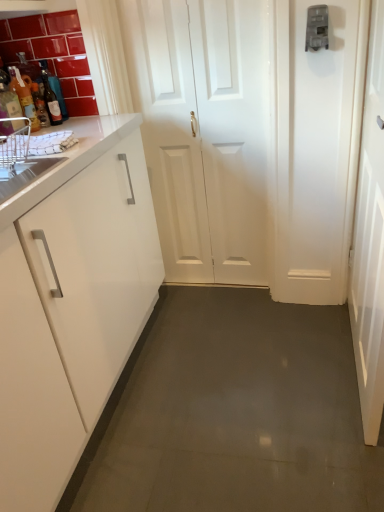
In order to click on white glossy door at center, which is the 1th door in left-to-right order in this screenshot , I will do `click(206, 132)`.

Looking at this image, what is the approximate height of white glossy sink at left?

white glossy sink at left is 6.37 inches in height.

I want to click on white glossy door at right, the second door from the left, so click(370, 240).

What is the approximate height of matte glass bottle at left, the 1th bottle viewed from the right?

matte glass bottle at left, the 1th bottle viewed from the right, is 7.41 inches tall.

The height and width of the screenshot is (512, 384). Describe the element at coordinates (40, 93) in the screenshot. I see `translucent glass bottle at left, arranged as the first bottle when viewed from the left` at that location.

Locate an element on the screen. white glossy door at center, which is the 1th door in left-to-right order is located at coordinates (206, 132).

How different are the orientations of matte glass bottle at left, which ranks as the third bottle in left-to-right order, and translucent glass bottle at left, arranged as the first bottle when viewed from the left, in degrees?

The facing directions of matte glass bottle at left, which ranks as the third bottle in left-to-right order, and translucent glass bottle at left, arranged as the first bottle when viewed from the left, are 0.00362 degrees apart.

In the scene shown: Is matte glass bottle at left, which ranks as the third bottle in left-to-right order, not within translucent glass bottle at left, arranged as the first bottle when viewed from the left?

Indeed, matte glass bottle at left, which ranks as the third bottle in left-to-right order, is completely outside translucent glass bottle at left, arranged as the first bottle when viewed from the left.

Can you confirm if matte glass bottle at left, the 1th bottle viewed from the right, is bigger than translucent glass bottle at left, the 3th bottle from the right?

Incorrect, matte glass bottle at left, the 1th bottle viewed from the right, is not larger than translucent glass bottle at left, the 3th bottle from the right.

Between matte glass bottle at left, the 1th bottle viewed from the right, and translucent glass bottle at left, arranged as the first bottle when viewed from the left, which one is positioned in front?

Positioned in front is matte glass bottle at left, the 1th bottle viewed from the right.

Considering the relative sizes of white glossy door at center, which is the 1th door in left-to-right order, and matte glass bottle at left, which ranks as the third bottle in left-to-right order, in the image provided, is white glossy door at center, which is the 1th door in left-to-right order, shorter than matte glass bottle at left, which ranks as the third bottle in left-to-right order,?

In fact, white glossy door at center, which is the 1th door in left-to-right order, may be taller than matte glass bottle at left, which ranks as the third bottle in left-to-right order.

Is white glossy door at center, acting as the 2th door starting from the right, behind matte glass bottle at left, which ranks as the third bottle in left-to-right order?

That is False.

Considering the relative sizes of white glossy door at center, which is the 1th door in left-to-right order, and matte glass bottle at left, which ranks as the third bottle in left-to-right order, in the image provided, is white glossy door at center, which is the 1th door in left-to-right order, wider than matte glass bottle at left, which ranks as the third bottle in left-to-right order,?

Yes.

Considering the points (230, 113) and (46, 85), which point is behind, point (230, 113) or point (46, 85)?

The point (230, 113) is behind.

Which object is positioned more to the left, translucent glass bottle at left, marked as the second bottle in a right-to-left arrangement, or translucent glass bottle at left, arranged as the first bottle when viewed from the left?

translucent glass bottle at left, arranged as the first bottle when viewed from the left, is more to the left.

Is translucent glass bottle at left, the second bottle viewed from the left, situated inside translucent glass bottle at left, arranged as the first bottle when viewed from the left, or outside?

translucent glass bottle at left, the second bottle viewed from the left, is spatially situated outside translucent glass bottle at left, arranged as the first bottle when viewed from the left.

From the image's perspective, between translucent glass bottle at left, marked as the second bottle in a right-to-left arrangement, and translucent glass bottle at left, arranged as the first bottle when viewed from the left, who is located below?

From the image's view, translucent glass bottle at left, marked as the second bottle in a right-to-left arrangement, is below.

In terms of width, does translucent glass bottle at left, marked as the second bottle in a right-to-left arrangement, look wider or thinner when compared to translucent glass bottle at left, arranged as the first bottle when viewed from the left?

Clearly, translucent glass bottle at left, marked as the second bottle in a right-to-left arrangement, has less width compared to translucent glass bottle at left, arranged as the first bottle when viewed from the left.

At what (x,y) coordinates should I click in order to perform the action: click on door that is the 2nd one when counting rightward from the translucent glass bottle at left, the 3th bottle from the right. Please return your answer as a coordinate pair (x, y). Looking at the image, I should click on (370, 240).

Consider the image. How far apart are translucent glass bottle at left, the 3th bottle from the right, and white glossy door at right, arranged as the first door when viewed from the right?

1.26 meters.

Is translucent glass bottle at left, arranged as the first bottle when viewed from the left, situated inside white glossy door at right, arranged as the first door when viewed from the right, or outside?

translucent glass bottle at left, arranged as the first bottle when viewed from the left, is outside white glossy door at right, arranged as the first door when viewed from the right.

Can you confirm if translucent glass bottle at left, arranged as the first bottle when viewed from the left, is wider than white glossy door at right, arranged as the first door when viewed from the right?

Incorrect, the width of translucent glass bottle at left, arranged as the first bottle when viewed from the left, does not surpass that of white glossy door at right, arranged as the first door when viewed from the right.

What's the angular difference between white glossy door at center, which is the 1th door in left-to-right order, and translucent glass bottle at left, arranged as the first bottle when viewed from the left,'s facing directions?

white glossy door at center, which is the 1th door in left-to-right order, and translucent glass bottle at left, arranged as the first bottle when viewed from the left, are facing 90 degrees away from each other.

From the image's perspective, is white glossy door at center, which is the 1th door in left-to-right order, on translucent glass bottle at left, arranged as the first bottle when viewed from the left?

No, from the image's perspective, white glossy door at center, which is the 1th door in left-to-right order, is not on top of translucent glass bottle at left, arranged as the first bottle when viewed from the left.

Do you think white glossy door at center, which is the 1th door in left-to-right order, is within translucent glass bottle at left, arranged as the first bottle when viewed from the left, or outside of it?

white glossy door at center, which is the 1th door in left-to-right order, is not inside translucent glass bottle at left, arranged as the first bottle when viewed from the left, it's outside.

This screenshot has height=512, width=384. What are the coordinates of `the 3rd bottle above the white glossy door at center, which is the 1th door in left-to-right order (from the image's perspective)` in the screenshot? It's located at (40, 93).

How different are the orientations of white glossy door at center, acting as the 2th door starting from the right, and white glossy sink at left in degrees?

white glossy door at center, acting as the 2th door starting from the right, and white glossy sink at left are facing 89.2 degrees away from each other.

The image size is (384, 512). What are the coordinates of `sink lying in front of the white glossy door at center, acting as the 2th door starting from the right` in the screenshot? It's located at (20, 164).

Does white glossy door at center, which is the 1th door in left-to-right order, appear on the right side of white glossy sink at left?

Yes.

From a real-world perspective, between white glossy door at center, which is the 1th door in left-to-right order, and white glossy sink at left, who is vertically lower?

In real-world perspective, white glossy door at center, which is the 1th door in left-to-right order, is lower.

Does white glossy sink at left appear on the right side of translucent glass bottle at left, marked as the second bottle in a right-to-left arrangement?

Indeed, white glossy sink at left is positioned on the right side of translucent glass bottle at left, marked as the second bottle in a right-to-left arrangement.

Based on their sizes in the image, would you say white glossy sink at left is bigger or smaller than translucent glass bottle at left, marked as the second bottle in a right-to-left arrangement?

Considering their sizes, white glossy sink at left takes up more space than translucent glass bottle at left, marked as the second bottle in a right-to-left arrangement.

Is white glossy sink at left shorter than translucent glass bottle at left, the second bottle viewed from the left?

Indeed, white glossy sink at left has a lesser height compared to translucent glass bottle at left, the second bottle viewed from the left.

In the image, is white glossy sink at left positioned in front of or behind translucent glass bottle at left, marked as the second bottle in a right-to-left arrangement?

Visually, white glossy sink at left is located in front of translucent glass bottle at left, marked as the second bottle in a right-to-left arrangement.

This screenshot has height=512, width=384. What are the coordinates of `the 1st bottle in front of the translucent glass bottle at left, the 3th bottle from the right` in the screenshot? It's located at (50, 97).

From the matte glass bottle at left, which ranks as the third bottle in left-to-right order, count 1st door to the right and point to it. Please provide its 2D coordinates.

[(206, 132)]

From the picture: Considering their positions, is translucent glass bottle at left, the 3th bottle from the right, positioned closer to white glossy door at right, arranged as the first door when viewed from the right, than translucent glass bottle at left, marked as the second bottle in a right-to-left arrangement?

translucent glass bottle at left, the 3th bottle from the right, is positioned closer to the anchor white glossy door at right, arranged as the first door when viewed from the right.

When comparing their distances from translucent glass bottle at left, arranged as the first bottle when viewed from the left, does translucent glass bottle at left, the second bottle viewed from the left, or matte glass bottle at left, the 1th bottle viewed from the right, seem further?

The object further to translucent glass bottle at left, arranged as the first bottle when viewed from the left, is translucent glass bottle at left, the second bottle viewed from the left.

Considering their positions, is white glossy door at right, arranged as the first door when viewed from the right, positioned closer to translucent glass bottle at left, the 3th bottle from the right, than white glossy door at center, which is the 1th door in left-to-right order?

Based on the image, white glossy door at center, which is the 1th door in left-to-right order, appears to be nearer to translucent glass bottle at left, the 3th bottle from the right.

Which object lies nearer to the anchor point white glossy sink at left, translucent glass bottle at left, the second bottle viewed from the left, or white glossy door at right, arranged as the first door when viewed from the right?

The object closer to white glossy sink at left is translucent glass bottle at left, the second bottle viewed from the left.

When comparing their distances from matte glass bottle at left, which ranks as the third bottle in left-to-right order, does translucent glass bottle at left, arranged as the first bottle when viewed from the left, or white glossy sink at left seem closer?

translucent glass bottle at left, arranged as the first bottle when viewed from the left, is positioned closer to the anchor matte glass bottle at left, which ranks as the third bottle in left-to-right order.

Looking at this image, estimate the real-world distances between objects in this image. Which object is further from matte glass bottle at left, which ranks as the third bottle in left-to-right order, white glossy sink at left or white glossy door at center, which is the 1th door in left-to-right order?

white glossy door at center, which is the 1th door in left-to-right order, is further to matte glass bottle at left, which ranks as the third bottle in left-to-right order.

Based on the photo, looking at the image, which one is located further to matte glass bottle at left, the 1th bottle viewed from the right, white glossy door at right, arranged as the first door when viewed from the right, or white glossy sink at left?

white glossy door at right, arranged as the first door when viewed from the right.

Estimate the real-world distances between objects in this image. Which object is closer to white glossy sink at left, white glossy door at center, acting as the 2th door starting from the right, or translucent glass bottle at left, marked as the second bottle in a right-to-left arrangement?

translucent glass bottle at left, marked as the second bottle in a right-to-left arrangement, is positioned closer to the anchor white glossy sink at left.

The width and height of the screenshot is (384, 512). Find the location of `door located between translucent glass bottle at left, the second bottle viewed from the left, and white glossy door at right, the second door from the left, in the left-right direction`. door located between translucent glass bottle at left, the second bottle viewed from the left, and white glossy door at right, the second door from the left, in the left-right direction is located at coordinates (206, 132).

Identify the location of sink between translucent glass bottle at left, marked as the second bottle in a right-to-left arrangement, and white glossy door at center, acting as the 2th door starting from the right, in the horizontal direction. (20, 164).

At what (x,y) coordinates should I click in order to perform the action: click on bottle between white glossy sink at left and matte glass bottle at left, which ranks as the third bottle in left-to-right order, from front to back. Please return your answer as a coordinate pair (x, y). The image size is (384, 512). Looking at the image, I should click on (24, 97).

At what (x,y) coordinates should I click in order to perform the action: click on sink between translucent glass bottle at left, arranged as the first bottle when viewed from the left, and white glossy door at center, acting as the 2th door starting from the right. Please return your answer as a coordinate pair (x, y). This screenshot has height=512, width=384. Looking at the image, I should click on (20, 164).